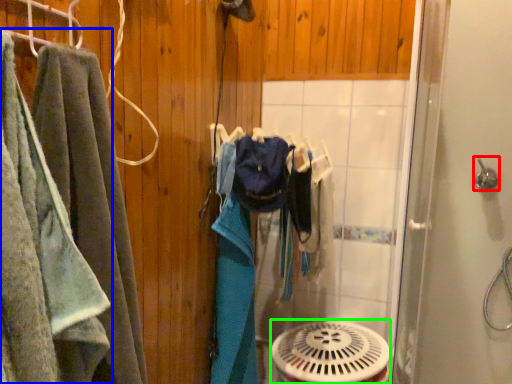
Question: Which object is positioned closest to shower (highlighted by a red box)? Select from towel (highlighted by a blue box) and mechanical fan (highlighted by a green box).

Choices:
 (A) towel
 (B) mechanical fan

Answer: (B)